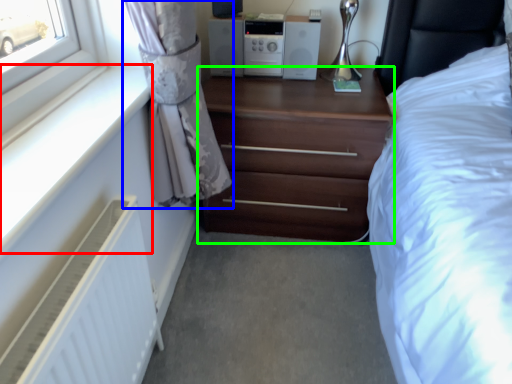
Question: Which object is the farthest from window sill (highlighted by a red box)? Choose among these: curtain (highlighted by a blue box) or chest of drawers (highlighted by a green box).

Choices:
 (A) curtain
 (B) chest of drawers

Answer: (B)